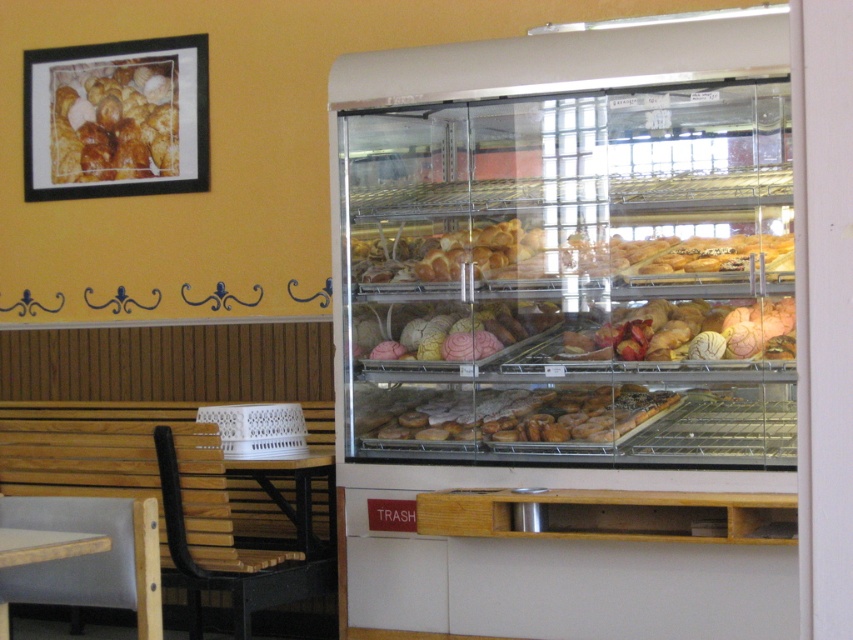
You are a customer at the bakery and want to choose between the matte white croissant at center and the golden brown pastry at center. Which one is bigger?

The matte white croissant at center is larger in size than the golden brown pastry at center.

You are a customer in the bakery and want to grab both the glazed doughnuts at center and the matte white pastries at center. Which one should you reach for first if you want to pick up the one that is on the right side?

The glazed doughnuts at center are to the right of the matte white pastries at center, so you should reach for the glazed doughnuts at center first if you want the one on the right side.